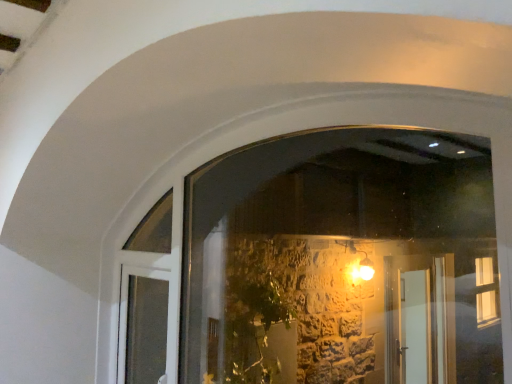
Question: From their relative heights in the image, would you say transparent glass window at center is taller or shorter than white glossy door at lower left?

Choices:
 (A) tall
 (B) short

Answer: (A)

Question: Is transparent glass window at center bigger or smaller than white glossy door at lower left?

Choices:
 (A) small
 (B) big

Answer: (B)

Question: Considering the positions of transparent glass window at center and white glossy door at lower left in the image, is transparent glass window at center wider or thinner than white glossy door at lower left?

Choices:
 (A) wide
 (B) thin

Answer: (B)

Question: In terms of width, does white glossy door at lower left look wider or thinner when compared to transparent glass window at center?

Choices:
 (A) thin
 (B) wide

Answer: (B)

Question: Is point (155, 286) positioned closer to the camera than point (367, 299)?

Choices:
 (A) closer
 (B) farther

Answer: (A)

Question: Is white glossy door at lower left spatially inside transparent glass window at center, or outside of it?

Choices:
 (A) outside
 (B) inside

Answer: (B)

Question: From a real-world perspective, relative to transparent glass window at center, is white glossy door at lower left vertically above or below?

Choices:
 (A) above
 (B) below

Answer: (B)